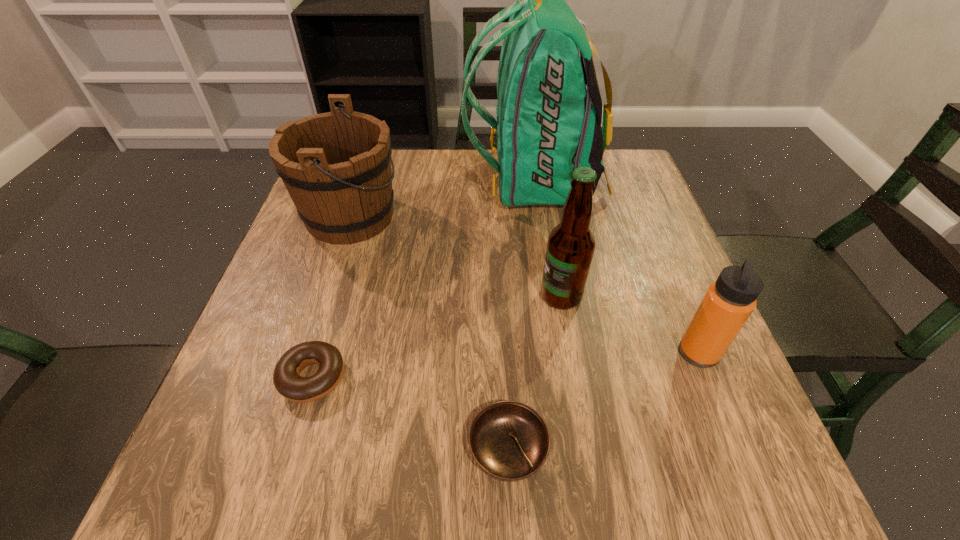
Locate an element on the screen. This screenshot has height=540, width=960. vacant space positioned on the label of the beer bottle is located at coordinates (496, 296).

I want to click on vacant space located on the label of the beer bottle, so click(x=378, y=296).

Locate an element on the screen. The height and width of the screenshot is (540, 960). free space located 0.170m on the label of the beer bottle is located at coordinates (457, 296).

The width and height of the screenshot is (960, 540). I want to click on free space located 0.320m on the side of the wine bucket with the handle for carrying, so click(532, 216).

This screenshot has height=540, width=960. I want to click on free space located on the left of the rightmost object, so click(x=613, y=353).

Where is `free space located 0.090m on the right of the doughnut`? free space located 0.090m on the right of the doughnut is located at coordinates coord(397,377).

This screenshot has width=960, height=540. Identify the location of vacant region located on the right of the nearest object. (690, 449).

The width and height of the screenshot is (960, 540). I want to click on backpack at the far edge, so click(x=548, y=124).

You are a GUI agent. You are given a task and a screenshot of the screen. Output one action in this format:
    pyautogui.click(x=<x>, y=<y>)
    Task: Click on the wine bucket that is at the far edge
    The height and width of the screenshot is (540, 960).
    Given the screenshot: What is the action you would take?
    pyautogui.click(x=336, y=166)

Identify the location of object located in the near edge section of the desktop. The image size is (960, 540). (509, 440).